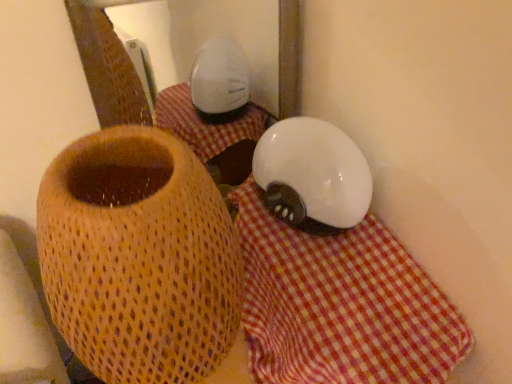
Locate an element on the screen. This screenshot has width=512, height=384. free location above white checkered cloth at center (from a real-world perspective) is located at coordinates pos(339,282).